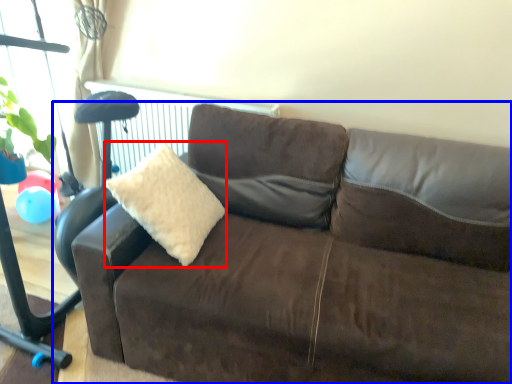
Question: Which of the following is the farthest to the observer, throw pillow (highlighted by a red box) or studio couch (highlighted by a blue box)?

Choices:
 (A) throw pillow
 (B) studio couch

Answer: (A)